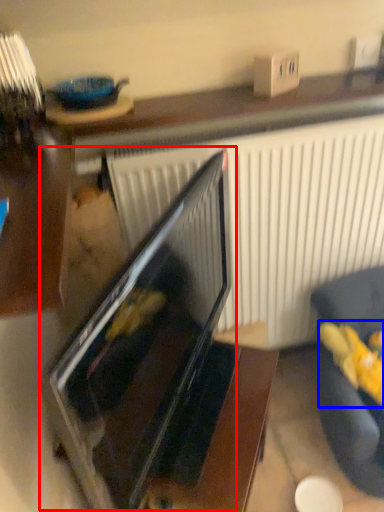
Question: Among these objects, which one is nearest to the camera, oven (highlighted by a red box) or stuff (highlighted by a blue box)?

Choices:
 (A) oven
 (B) stuff

Answer: (A)